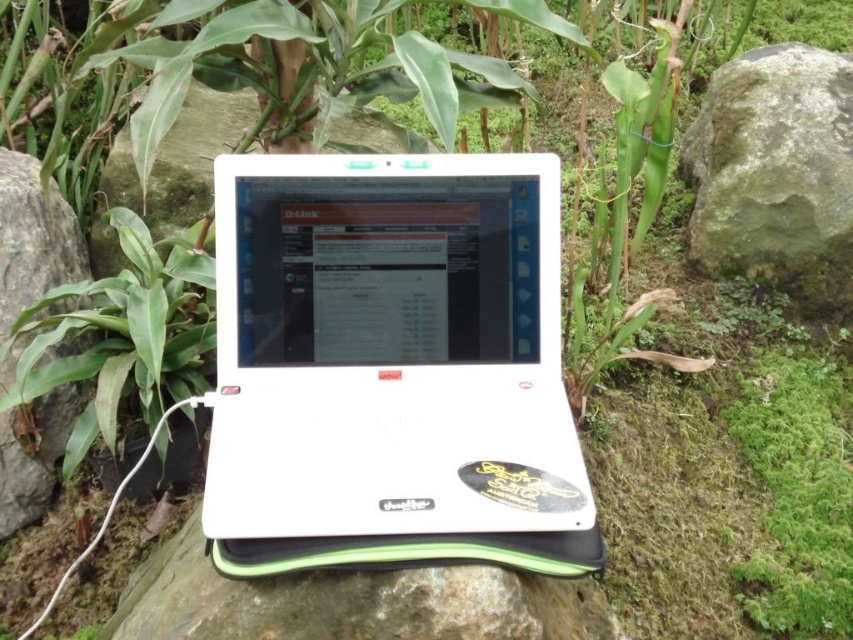
Question: Does green leafy plant at left appear under gray rock at left?

Choices:
 (A) no
 (B) yes

Answer: (A)

Question: Which point is farther to the camera?

Choices:
 (A) (576, 452)
 (B) (49, 305)

Answer: (B)

Question: Which point is farther from the camera taking this photo?

Choices:
 (A) (784, 189)
 (B) (74, 285)
 (C) (398, 256)

Answer: (A)

Question: Which object is positioned farthest from the white plastic laptop at center?

Choices:
 (A) gray rock at left
 (B) green leafy plant at left

Answer: (A)

Question: Is green mossy rock at right further to camera compared to gray rock at left?

Choices:
 (A) yes
 (B) no

Answer: (A)

Question: Is green leafy plant at left above gray rock at left?

Choices:
 (A) yes
 (B) no

Answer: (A)